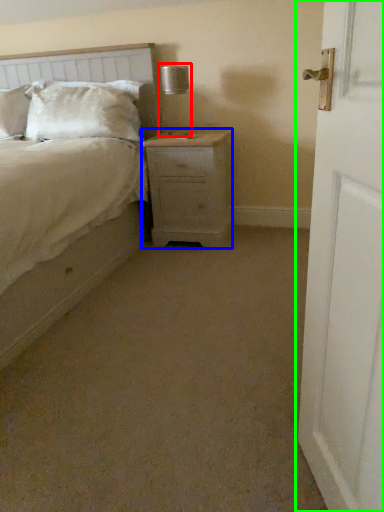
Question: Based on their relative distances, which object is farther from table lamp (highlighted by a red box)? Choose from nightstand (highlighted by a blue box) and door (highlighted by a green box).

Choices:
 (A) nightstand
 (B) door

Answer: (B)